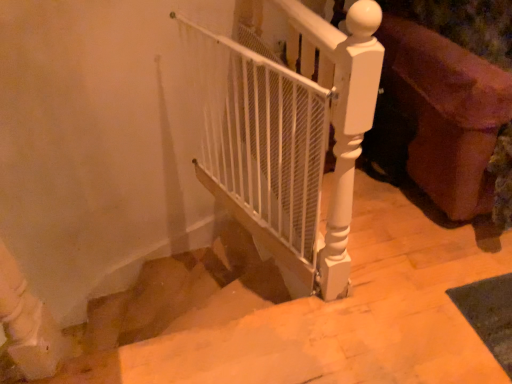
Question: Is white mesh gate at center further to the viewer compared to smooth beige stairs at center?

Choices:
 (A) no
 (B) yes

Answer: (B)

Question: Would you say white mesh gate at center is outside smooth beige stairs at center?

Choices:
 (A) yes
 (B) no

Answer: (A)

Question: Does white mesh gate at center come in front of smooth beige stairs at center?

Choices:
 (A) no
 (B) yes

Answer: (A)

Question: From a real-world perspective, is white mesh gate at center located beneath smooth beige stairs at center?

Choices:
 (A) no
 (B) yes

Answer: (A)

Question: From the image's perspective, is white mesh gate at center over smooth beige stairs at center?

Choices:
 (A) yes
 (B) no

Answer: (A)

Question: From the image's perspective, is white mesh gate at center positioned above or below velvet purple sofa at right?

Choices:
 (A) above
 (B) below

Answer: (B)

Question: Does point (329, 110) appear closer or farther from the camera than point (415, 135)?

Choices:
 (A) farther
 (B) closer

Answer: (B)

Question: Considering the positions of white mesh gate at center and velvet purple sofa at right in the image, is white mesh gate at center wider or thinner than velvet purple sofa at right?

Choices:
 (A) thin
 (B) wide

Answer: (A)

Question: Would you say white mesh gate at center is to the left or to the right of velvet purple sofa at right in the picture?

Choices:
 (A) left
 (B) right

Answer: (A)

Question: Considering the positions of point (487, 195) and point (331, 365), is point (487, 195) closer or farther from the camera than point (331, 365)?

Choices:
 (A) farther
 (B) closer

Answer: (A)

Question: Relative to smooth beige stairs at center, is velvet purple sofa at right in front or behind?

Choices:
 (A) front
 (B) behind

Answer: (B)

Question: Looking at the image, does velvet purple sofa at right seem bigger or smaller compared to smooth beige stairs at center?

Choices:
 (A) small
 (B) big

Answer: (B)

Question: In the image, is velvet purple sofa at right on the left side or the right side of smooth beige stairs at center?

Choices:
 (A) left
 (B) right

Answer: (B)

Question: From the image's perspective, is smooth beige stairs at center located above or below velvet purple sofa at right?

Choices:
 (A) above
 (B) below

Answer: (B)

Question: In the image, is smooth beige stairs at center on the left side or the right side of velvet purple sofa at right?

Choices:
 (A) right
 (B) left

Answer: (B)